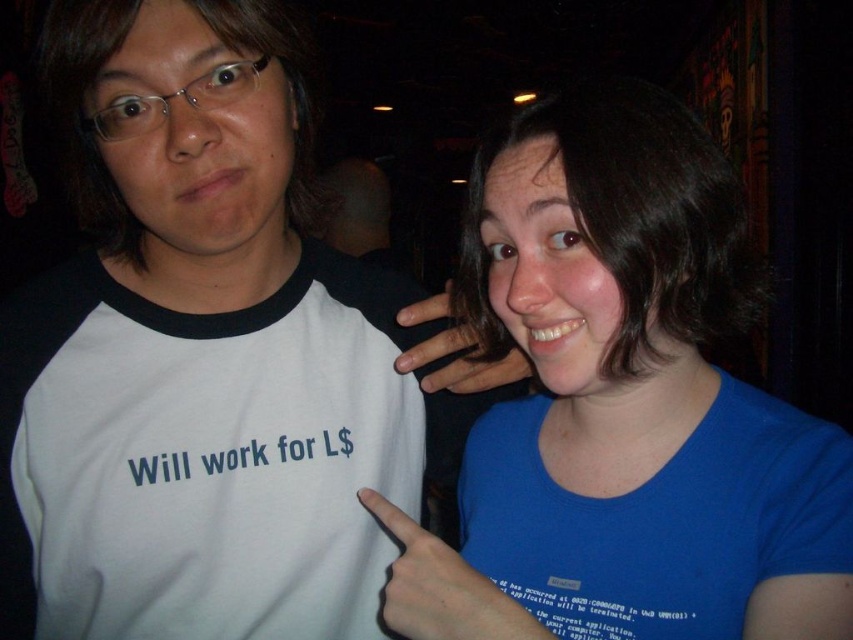
Question: Does white fabric t-shirt at left have a smaller size compared to blue fabric hand at center?

Choices:
 (A) no
 (B) yes

Answer: (A)

Question: Which point appears closest to the camera in this image?

Choices:
 (A) (421, 362)
 (B) (523, 296)
 (C) (90, 284)
 (D) (492, 602)

Answer: (D)

Question: Estimate the real-world distances between objects in this image. Which object is farther from the blue cotton shirt at right?

Choices:
 (A) blue fabric hand at center
 (B) white fabric t-shirt at left
 (C) matte skin hand at center

Answer: (B)

Question: Is blue fabric hand at center wider than matte skin hand at center?

Choices:
 (A) no
 (B) yes

Answer: (B)

Question: Can you confirm if blue cotton shirt at right is positioned to the left of matte skin hand at center?

Choices:
 (A) yes
 (B) no

Answer: (B)

Question: Based on their relative distances, which object is nearer to the blue cotton shirt at right?

Choices:
 (A) blue fabric hand at center
 (B) matte skin hand at center
 (C) white fabric t-shirt at left

Answer: (A)